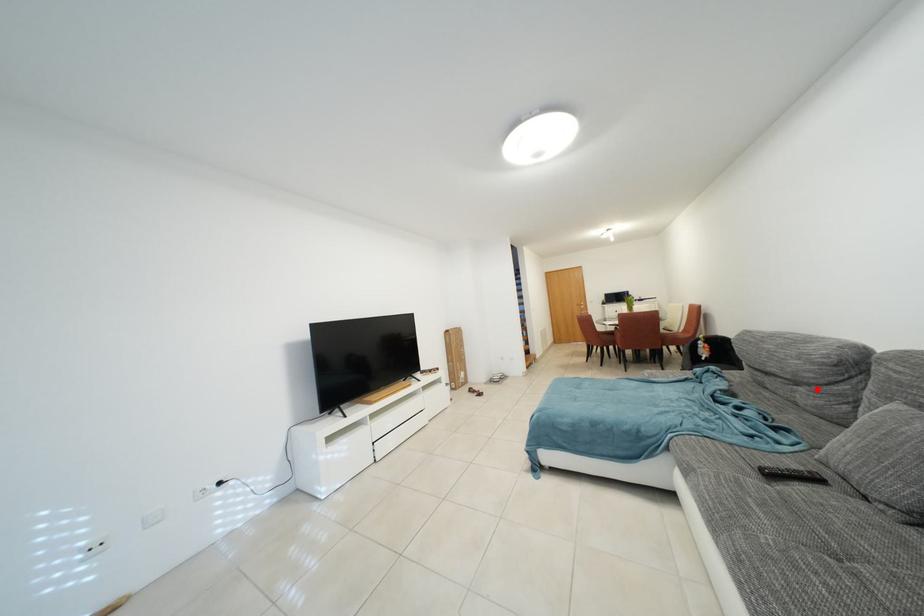
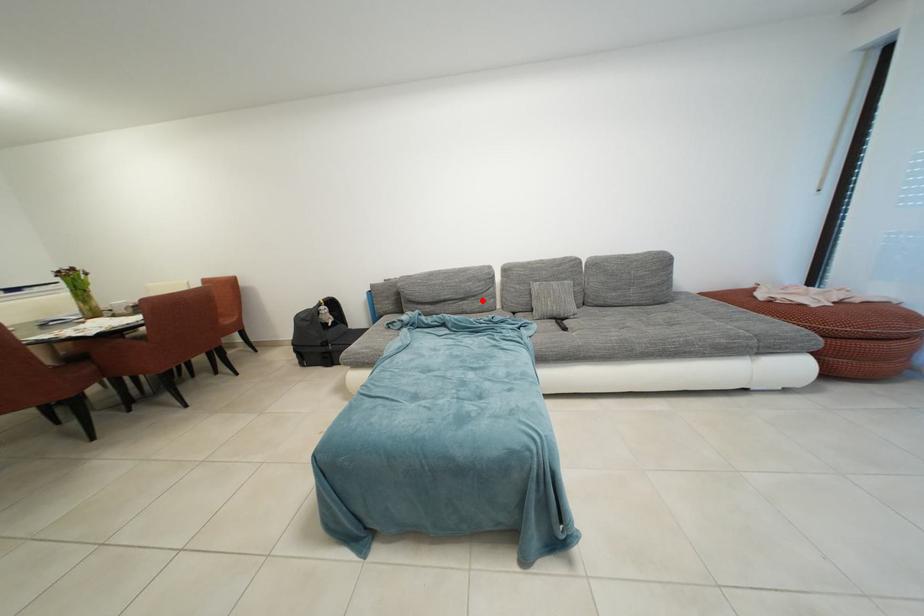
I am providing you with two images of the same scene from different viewpoints. A red point is marked on the first image and another point is marked on the second image. Does the point marked in image1 correspond to the same location as the one in image2?

Yes